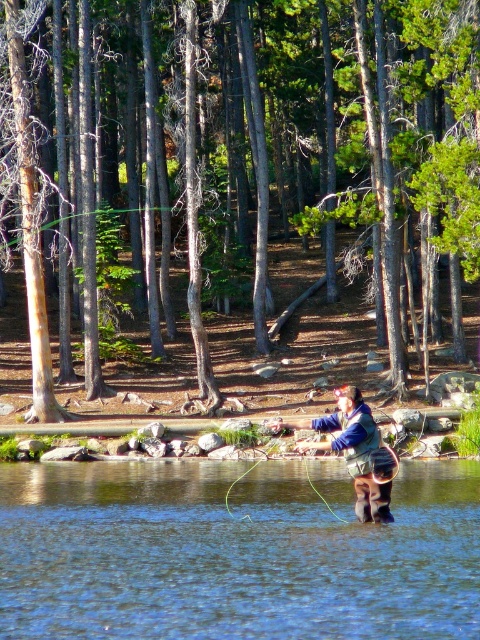
Can you confirm if blue water at center is wider than blue fleece jacket at center?

Indeed, blue water at center has a greater width compared to blue fleece jacket at center.

Can you confirm if blue water at center is shorter than blue fleece jacket at center?

Indeed, blue water at center has a lesser height compared to blue fleece jacket at center.

Is point (287, 534) in front of point (348, 440)?

Yes, it is in front of point (348, 440).

I want to click on blue water at center, so click(x=235, y=552).